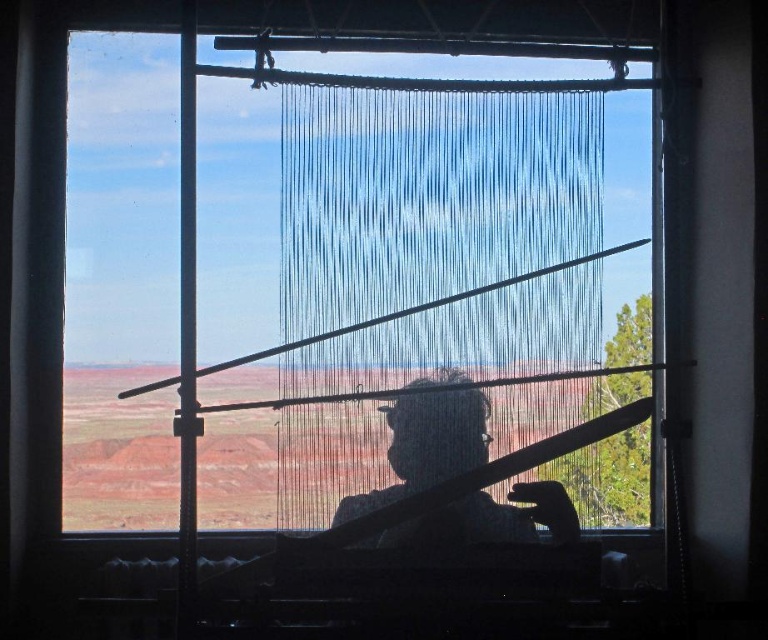
You are trying to see the landscape outside through the window. The blue string curtain at center and the transparent glass window at center are both in your view. Which object allows you to see more of the landscape?

The transparent glass window at center allows you to see more of the landscape because it has a greater width than the blue string curtain at center.

You are standing inside a room and want to see the landscape outside the window clearly. The blue string curtain at center and transparent glass window at center are in your view. Which object should you move to get a clearer view?

You should move the blue string curtain at center, as it is in front of the transparent glass window at center and obstructing the view.

You are trying to hang a decorative ribbon between the transparent glass window at center and the silhouette fabric at center. What is the minimum length of ribbon you need to ensure it can stretch between them?

The distance between the transparent glass window at center and the silhouette fabric at center is 15.82 inches, so the ribbon must be at least 15.82 inches long to stretch between them.